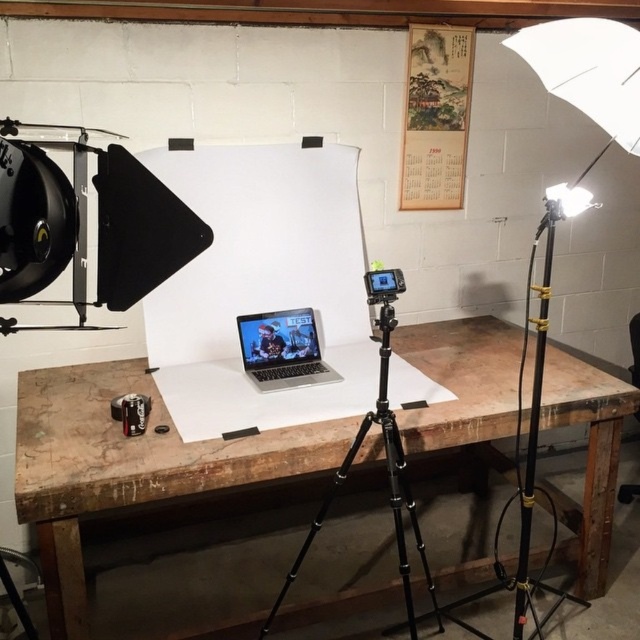
Who is higher up, white matte umbrella at upper right or silver metallic laptop at center?

white matte umbrella at upper right is higher up.

Can you confirm if white matte umbrella at upper right is positioned below silver metallic laptop at center?

No, white matte umbrella at upper right is not below silver metallic laptop at center.

Is point (566, 54) positioned before point (296, 321)?

Yes.

Where is `white matte umbrella at upper right`? white matte umbrella at upper right is located at coordinates (588, 68).

Between point (266, 448) and point (394, 509), which one is positioned behind?

Point (266, 448)

Where is `wooden table at center`? This screenshot has width=640, height=640. wooden table at center is located at coordinates (125, 465).

Is white matte umbrella at upper right bigger than black metal tripod at center?

Incorrect, white matte umbrella at upper right is not larger than black metal tripod at center.

Which is in front, point (592, 99) or point (394, 499)?

Point (592, 99) is in front.

Find the location of `white matte umbrella at upper right`. white matte umbrella at upper right is located at coordinates tap(588, 68).